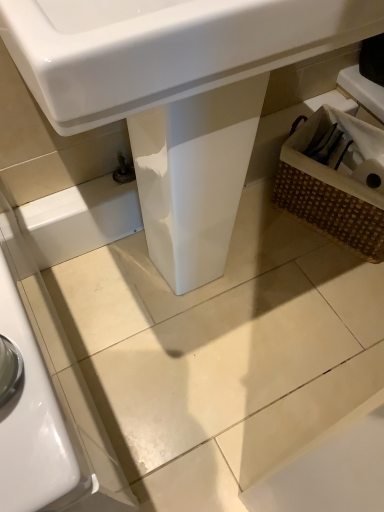
Question: Is brown woven basket at right further to camera compared to white glossy sink at center?

Choices:
 (A) yes
 (B) no

Answer: (A)

Question: Is white glossy sink at center a part of brown woven basket at right?

Choices:
 (A) yes
 (B) no

Answer: (B)

Question: Is brown woven basket at right to the left of white glossy sink at center from the viewer's perspective?

Choices:
 (A) no
 (B) yes

Answer: (A)

Question: Is brown woven basket at right touching white glossy sink at center?

Choices:
 (A) yes
 (B) no

Answer: (B)

Question: Can you confirm if brown woven basket at right is positioned to the right of white glossy sink at center?

Choices:
 (A) no
 (B) yes

Answer: (B)

Question: Is brown woven basket at right positioned with its back to white glossy sink at center?

Choices:
 (A) yes
 (B) no

Answer: (B)

Question: From a real-world perspective, is white glossy sink at center below brown woven basket at right?

Choices:
 (A) yes
 (B) no

Answer: (B)

Question: Is white glossy sink at center to the right of brown woven basket at right from the viewer's perspective?

Choices:
 (A) no
 (B) yes

Answer: (A)

Question: Could you tell me if white glossy sink at center is turned towards brown woven basket at right?

Choices:
 (A) no
 (B) yes

Answer: (A)

Question: Considering the relative positions of white glossy sink at center and brown woven basket at right in the image provided, is white glossy sink at center to the left of brown woven basket at right from the viewer's perspective?

Choices:
 (A) yes
 (B) no

Answer: (A)

Question: Is the position of white glossy sink at center more distant than that of brown woven basket at right?

Choices:
 (A) no
 (B) yes

Answer: (A)

Question: Is brown woven basket at right located within white glossy sink at center?

Choices:
 (A) no
 (B) yes

Answer: (A)

Question: Considering the positions of brown woven basket at right and white glossy sink at center in the image, is brown woven basket at right taller or shorter than white glossy sink at center?

Choices:
 (A) tall
 (B) short

Answer: (B)